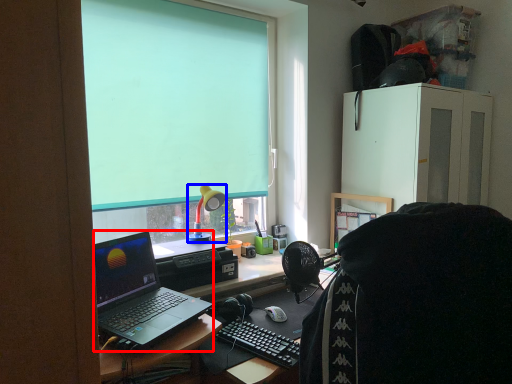
Question: Which of the following is the closest to the observer, laptop (highlighted by a red box) or lamp (highlighted by a blue box)?

Choices:
 (A) laptop
 (B) lamp

Answer: (A)